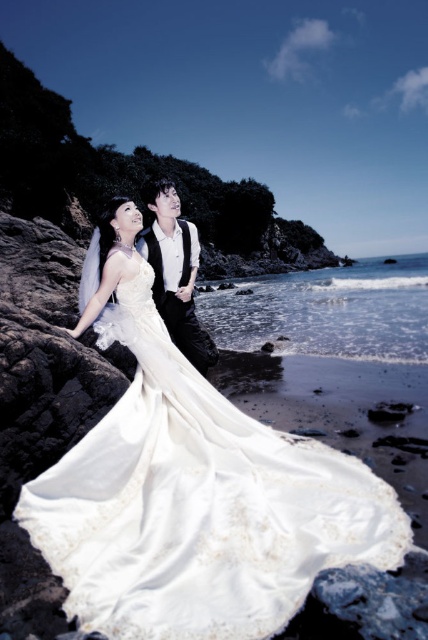
Question: Among these points, which one is nearest to the camera?

Choices:
 (A) (247, 451)
 (B) (190, 291)

Answer: (A)

Question: Which of the following is the closest to the observer?

Choices:
 (A) (95, 456)
 (B) (178, 298)

Answer: (A)

Question: Is satin/sheen dress at center above black satin vest at center?

Choices:
 (A) yes
 (B) no

Answer: (B)

Question: In this image, where is satin/sheen dress at center located relative to black satin vest at center?

Choices:
 (A) right
 (B) left

Answer: (A)

Question: In this image, where is satin/sheen dress at center located relative to black satin vest at center?

Choices:
 (A) left
 (B) right

Answer: (B)

Question: Which point appears farthest from the camera in this image?

Choices:
 (A) (121, 417)
 (B) (192, 230)

Answer: (B)